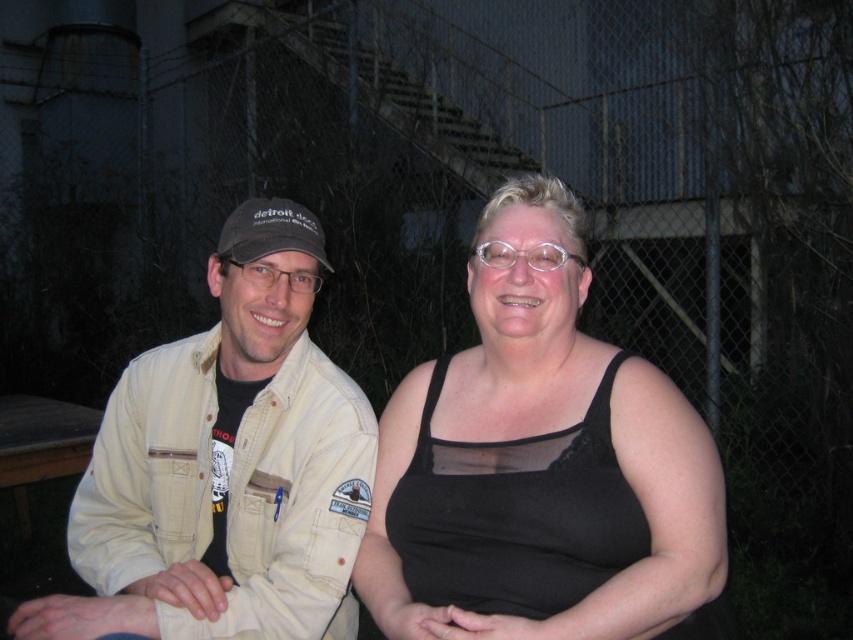
Based on the photo, is beige cotton jacket at left to the left of dark gray fabric baseball cap at left from the viewer's perspective?

Indeed, beige cotton jacket at left is positioned on the left side of dark gray fabric baseball cap at left.

Is point (340, 536) more distant than point (219, 236)?

No, (340, 536) is closer to viewer.

Does point (227, 353) come in front of point (221, 246)?

That is False.

The width and height of the screenshot is (853, 640). I want to click on beige cotton jacket at left, so click(225, 467).

Can you confirm if black sheer tank top at center is bigger than dark gray fabric baseball cap at left?

Indeed, black sheer tank top at center has a larger size compared to dark gray fabric baseball cap at left.

Is point (519, 416) positioned in front of point (245, 228)?

Yes, point (519, 416) is in front of point (245, 228).

Locate an element on the screen. The height and width of the screenshot is (640, 853). black sheer tank top at center is located at coordinates pyautogui.click(x=540, y=465).

Is black sheer tank top at center bigger than beige cotton jacket at left?

No, black sheer tank top at center is not bigger than beige cotton jacket at left.

Between point (718, 536) and point (172, 387), which one is positioned in front?

Positioned in front is point (718, 536).

Find the location of a particular element. The image size is (853, 640). black sheer tank top at center is located at coordinates (540, 465).